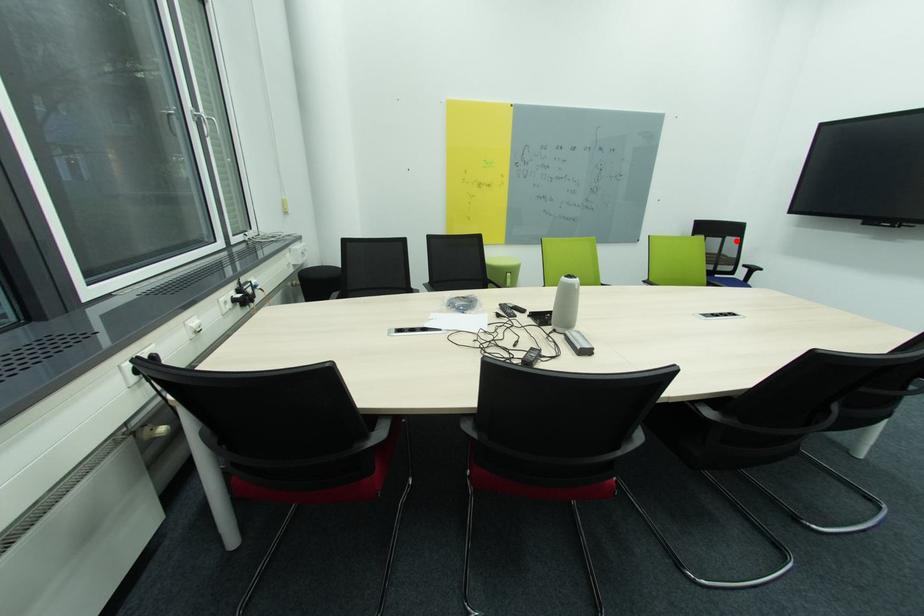
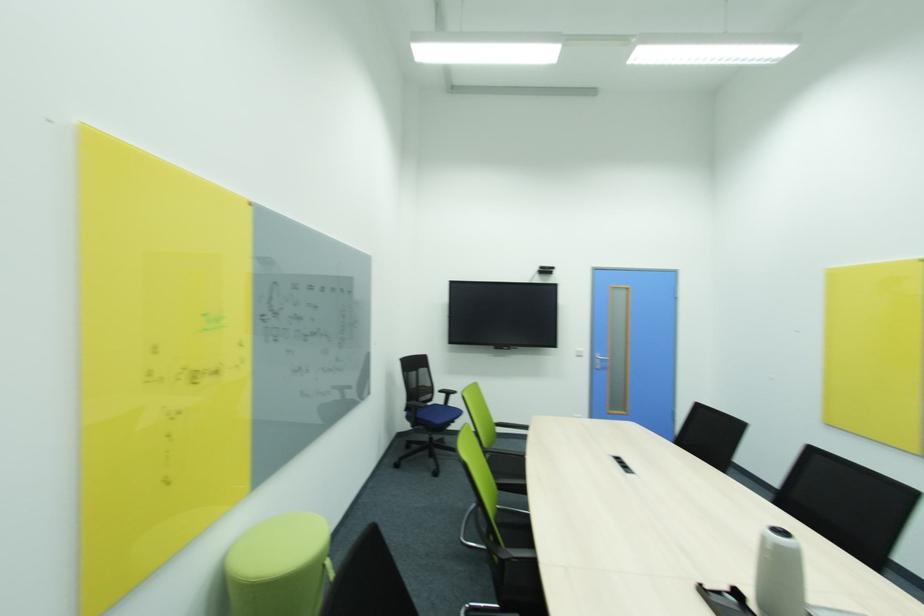
Find the pixel in the second image that matches the highlighted location in the first image.

(428, 371)